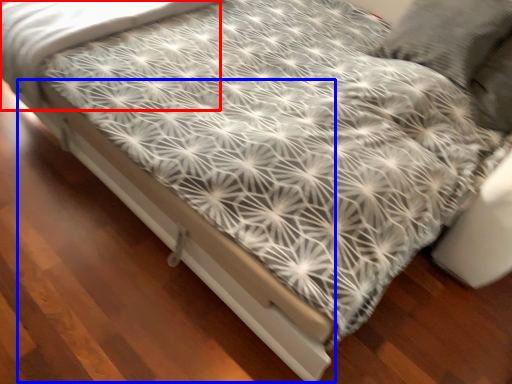
Question: Which of the following is the farthest to the observer, sheet (highlighted by a red box) or bed frame (highlighted by a blue box)?

Choices:
 (A) sheet
 (B) bed frame

Answer: (A)